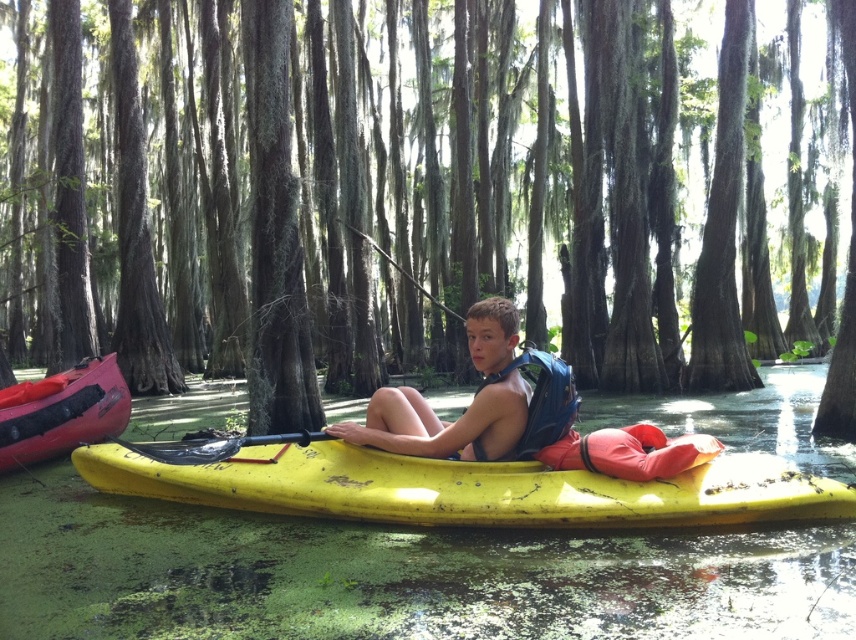
You are planning to cross the swamp in a small boat. You see the green algae water at center and the rubberized red canoe at left. Which object is wider?

The green algae water at center is wider than the rubberized red canoe at left according to the description.

You are navigating a kayak in the swamp and need to avoid the green algae water at center. What coordinates should you steer towards to stay clear of it?

The green algae water at center is located at coordinates point (395, 573). To avoid it, steer towards coordinates that are not point (395, 573).

You are navigating a kayak in the swamp and need to avoid the green algae water at center. Which direction should you steer to move away from the point marked at coordinates (x=395, y=573)?

The point at coordinates (x=395, y=573) is located on the green algae water at center. To move away from this point, you should steer in any direction away from the center of the water, such as towards the edges of the swamp or towards the surrounding cypress trees.